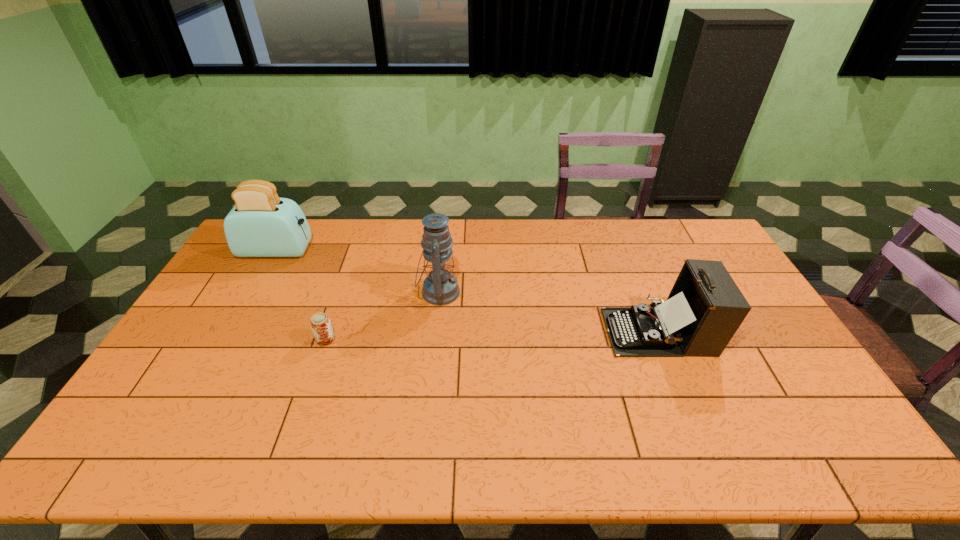
Identify the location of empty space between the lantern and the third tallest object. The image size is (960, 540). (549, 312).

This screenshot has height=540, width=960. I want to click on free spot between the leftmost object and the rightmost object, so click(468, 291).

You are a GUI agent. You are given a task and a screenshot of the screen. Output one action in this format:
    pyautogui.click(x=<x>, y=<y>)
    Task: Click on the free space between the toaster and the shortest object
    The image size is (960, 540).
    Given the screenshot: What is the action you would take?
    pyautogui.click(x=301, y=295)

Locate an element on the screen. vacant space that's between the second object from left to right and the toaster is located at coordinates coord(301,295).

At what (x,y) coordinates should I click in order to perform the action: click on vacant area that lies between the rightmost object and the toaster. Please return your answer as a coordinate pair (x, y). The image size is (960, 540). Looking at the image, I should click on (468, 291).

Locate an element on the screen. free point between the rightmost object and the shortest object is located at coordinates (492, 335).

Where is `vacant space that's between the third tallest object and the third object from left to right`? The height and width of the screenshot is (540, 960). vacant space that's between the third tallest object and the third object from left to right is located at coordinates (549, 312).

Find the location of a particular element. vacant area between the third object from left to right and the third tallest object is located at coordinates (549, 312).

You are a GUI agent. You are given a task and a screenshot of the screen. Output one action in this format:
    pyautogui.click(x=<x>, y=<y>)
    Task: Click on the vacant point located between the typewriter and the beer can
    
    Given the screenshot: What is the action you would take?
    pyautogui.click(x=492, y=335)

I want to click on free spot between the typewriter and the beer can, so click(492, 335).